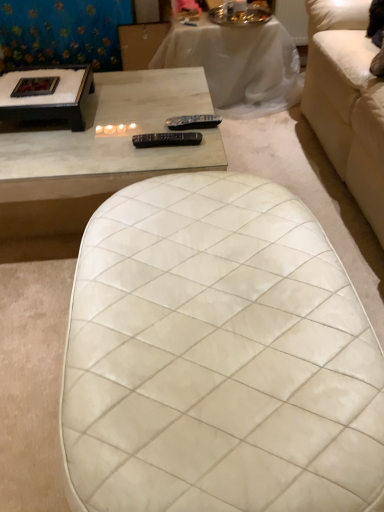
Question: In the image, is white marble coffee table at upper left, acting as the first coffee table starting from the right, on the left side or the right side of white quilted ottoman at center, the first table ordered from the bottom?

Choices:
 (A) left
 (B) right

Answer: (A)

Question: In terms of height, does white marble coffee table at upper left, placed as the 2th coffee table when sorted from left to right, look taller or shorter compared to white quilted ottoman at center, marked as the 1th table in a front-to-back arrangement?

Choices:
 (A) short
 (B) tall

Answer: (A)

Question: Which object is positioned closest to the white marble coffee table at upper left, acting as the first coffee table starting from the right?

Choices:
 (A) white marble table at upper center, the 1th table viewed from the top
 (B) black plastic remote at center, which ranks as the first remote in bottom-to-top order
 (C) black wood coffee table at upper left, which ranks as the second coffee table in right-to-left order
 (D) blue floral fabric at upper left
 (E) black plastic remote at center, which appears as the 2th remote when ordered from the bottom

Answer: (C)

Question: Which object is positioned farthest from the black wood coffee table at upper left, which ranks as the first coffee table in left-to-right order?

Choices:
 (A) white marble table at upper center, the 1th table viewed from the top
 (B) blue floral fabric at upper left
 (C) black plastic remote at center, placed as the 1th remote when sorted from front to back
 (D) black plastic remote at center, the 2th remote in the front-to-back sequence
 (E) white quilted ottoman at center, the first table ordered from the bottom

Answer: (A)